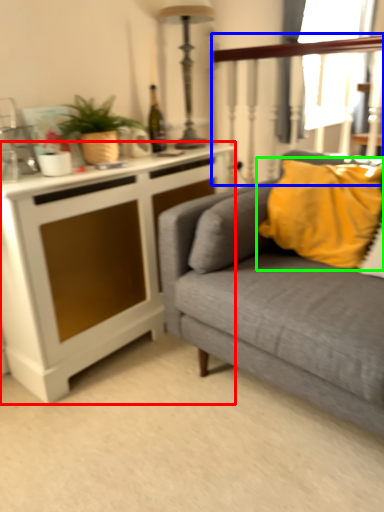
Question: Considering the real-world distances, which object is farthest from cabinetry (highlighted by a red box)? rail (highlighted by a blue box) or pillow (highlighted by a green box)?

Choices:
 (A) rail
 (B) pillow

Answer: (A)